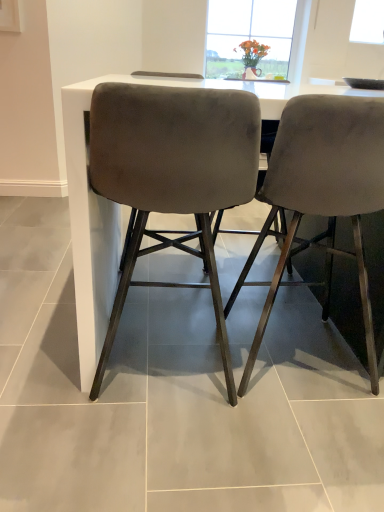
Question: Could you tell me if velvet grey chair at right, which ranks as the second chair in left-to-right order, is turned towards suede-like gray chair at center, which is counted as the 2th chair, starting from the right?

Choices:
 (A) yes
 (B) no

Answer: (B)

Question: Can you see velvet grey chair at right, the first chair positioned from the right, touching suede-like gray chair at center, which is counted as the 2th chair, starting from the right?

Choices:
 (A) yes
 (B) no

Answer: (B)

Question: Is the depth of velvet grey chair at right, which ranks as the second chair in left-to-right order, greater than that of suede-like gray chair at center, which is counted as the 2th chair, starting from the right?

Choices:
 (A) no
 (B) yes

Answer: (B)

Question: Does velvet grey chair at right, which ranks as the second chair in left-to-right order, have a larger size compared to suede-like gray chair at center, the first chair when ordered from left to right?

Choices:
 (A) yes
 (B) no

Answer: (A)

Question: Does velvet grey chair at right, the first chair positioned from the right, have a greater height compared to suede-like gray chair at center, the first chair when ordered from left to right?

Choices:
 (A) no
 (B) yes

Answer: (B)

Question: Does velvet grey chair at right, the first chair positioned from the right, have a smaller size compared to suede-like gray chair at center, which is counted as the 2th chair, starting from the right?

Choices:
 (A) no
 (B) yes

Answer: (A)

Question: From a real-world perspective, does suede-like gray chair at center, the first chair when ordered from left to right, stand above velvet grey chair at right, the first chair positioned from the right?

Choices:
 (A) yes
 (B) no

Answer: (B)

Question: From the image's perspective, is suede-like gray chair at center, which is counted as the 2th chair, starting from the right, located above velvet grey chair at right, which ranks as the second chair in left-to-right order?

Choices:
 (A) no
 (B) yes

Answer: (A)

Question: Is suede-like gray chair at center, which is counted as the 2th chair, starting from the right, to the right of velvet grey chair at right, the first chair positioned from the right, from the viewer's perspective?

Choices:
 (A) yes
 (B) no

Answer: (B)

Question: Is suede-like gray chair at center, which is counted as the 2th chair, starting from the right, not within velvet grey chair at right, which ranks as the second chair in left-to-right order?

Choices:
 (A) no
 (B) yes

Answer: (B)

Question: Is suede-like gray chair at center, which is counted as the 2th chair, starting from the right, with velvet grey chair at right, which ranks as the second chair in left-to-right order?

Choices:
 (A) yes
 (B) no

Answer: (B)

Question: Is suede-like gray chair at center, the first chair when ordered from left to right, smaller than velvet grey chair at right, the first chair positioned from the right?

Choices:
 (A) yes
 (B) no

Answer: (A)

Question: From the image's perspective, is velvet grey chair at right, which ranks as the second chair in left-to-right order, located above or below suede-like gray chair at center, the first chair when ordered from left to right?

Choices:
 (A) above
 (B) below

Answer: (A)